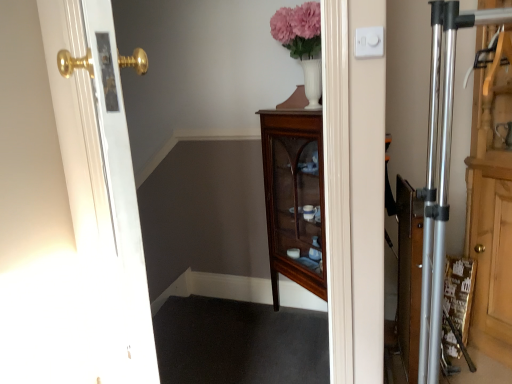
Find the location of a particular element. white glossy door at left is located at coordinates (101, 178).

The image size is (512, 384). Describe the element at coordinates (101, 178) in the screenshot. I see `white glossy door at left` at that location.

The image size is (512, 384). What do you see at coordinates (369, 42) in the screenshot?
I see `white plastic/light switch at upper right` at bounding box center [369, 42].

Where is `mahogany glass-front cabinet at center`? mahogany glass-front cabinet at center is located at coordinates (294, 198).

Who is shorter, white glossy door at left or wooden dresser at right?

white glossy door at left is shorter.

Which of these two, white glossy door at left or wooden dresser at right, is thinner?

white glossy door at left.

Can we say white glossy door at left lies outside wooden dresser at right?

That's correct, white glossy door at left is outside of wooden dresser at right.

Is point (484, 137) less distant than point (356, 34)?

No, (484, 137) is further to viewer.

Is wooden dresser at right beside white plastic/light switch at upper right?

No, wooden dresser at right is not in contact with white plastic/light switch at upper right.

Looking at this image, how far apart are wooden dresser at right and white plastic/light switch at upper right?

wooden dresser at right and white plastic/light switch at upper right are 33.51 inches apart.

Does wooden dresser at right appear on the left side of white plastic/light switch at upper right?

Incorrect, wooden dresser at right is not on the left side of white plastic/light switch at upper right.

Looking at this image, in terms of size, does white plastic/light switch at upper right appear bigger or smaller than mahogany glass-front cabinet at center?

Clearly, white plastic/light switch at upper right is smaller in size than mahogany glass-front cabinet at center.

Which is further, [378,33] or [302,272]?

The point [302,272] is farther.

In the scene shown: Between white plastic/light switch at upper right and mahogany glass-front cabinet at center, which one is positioned in front?

Positioned in front is white plastic/light switch at upper right.

In the image, there is a white glossy door at left. At what (x,y) coordinates should I click in order to perform the action: click on furniture below it (from a real-world perspective). Please return your answer as a coordinate pair (x, y). Looking at the image, I should click on (294, 198).

Is mahogany glass-front cabinet at center beside white glossy door at left?

No, mahogany glass-front cabinet at center is not touching white glossy door at left.

From a real-world perspective, is mahogany glass-front cabinet at center located higher than white glossy door at left?

Actually, mahogany glass-front cabinet at center is physically below white glossy door at left in the real world.

From the image's perspective, who appears lower, mahogany glass-front cabinet at center or white glossy door at left?

From the image's view, mahogany glass-front cabinet at center is below.

Is point (123, 213) positioned before point (366, 57)?

Yes.

Who is more distant, white glossy door at left or white plastic/light switch at upper right?

white plastic/light switch at upper right is further from the camera.

Considering the sizes of objects white glossy door at left and white plastic/light switch at upper right in the image provided, who is thinner, white glossy door at left or white plastic/light switch at upper right?

With smaller width is white plastic/light switch at upper right.

Based on the photo, are white glossy door at left and white plastic/light switch at upper right far apart?

Absolutely, white glossy door at left is distant from white plastic/light switch at upper right.

From their relative heights in the image, would you say white plastic/light switch at upper right is taller or shorter than white glossy door at left?

Considering their sizes, white plastic/light switch at upper right has less height than white glossy door at left.

Which of these two, white plastic/light switch at upper right or white glossy door at left, is smaller?

Smaller between the two is white plastic/light switch at upper right.

Which object is wider, white plastic/light switch at upper right or white glossy door at left?

white glossy door at left.

From the picture: From a real-world perspective, between white plastic/light switch at upper right and white glossy door at left, who is vertically lower?

white glossy door at left is physically lower.

Between white glossy door at left and mahogany glass-front cabinet at center, which one is positioned behind?

mahogany glass-front cabinet at center is more distant.

From the image's perspective, is white glossy door at left located above or below mahogany glass-front cabinet at center?

Based on their image positions, white glossy door at left is located above mahogany glass-front cabinet at center.

Between white glossy door at left and mahogany glass-front cabinet at center, which one has less height?

mahogany glass-front cabinet at center is shorter.

Find the location of `door that is below the wooden dresser at right (from the image's perspective)`. door that is below the wooden dresser at right (from the image's perspective) is located at coordinates (101, 178).

Where is `dresser located underneath the white plastic/light switch at upper right (from a real-world perspective)`? The height and width of the screenshot is (384, 512). dresser located underneath the white plastic/light switch at upper right (from a real-world perspective) is located at coordinates (490, 205).

From the image, which object appears to be farther from white glossy door at left, wooden dresser at right or mahogany glass-front cabinet at center?

The object further to white glossy door at left is wooden dresser at right.

Which object lies further to the anchor point mahogany glass-front cabinet at center, wooden dresser at right or white plastic/light switch at upper right?

white plastic/light switch at upper right lies further to mahogany glass-front cabinet at center than the other object.

From the image, which object appears to be nearer to mahogany glass-front cabinet at center, wooden dresser at right or white glossy door at left?

wooden dresser at right lies closer to mahogany glass-front cabinet at center than the other object.

In the scene shown: Based on their spatial positions, is mahogany glass-front cabinet at center or wooden dresser at right further from white glossy door at left?

Based on the image, wooden dresser at right appears to be further to white glossy door at left.

Considering their positions, is mahogany glass-front cabinet at center positioned closer to white plastic/light switch at upper right than white glossy door at left?

white glossy door at left.

From the picture: Based on their spatial positions, is white plastic/light switch at upper right or white glossy door at left closer to mahogany glass-front cabinet at center?

The object closer to mahogany glass-front cabinet at center is white glossy door at left.

Based on their spatial positions, is mahogany glass-front cabinet at center or white plastic/light switch at upper right further from white glossy door at left?

mahogany glass-front cabinet at center is positioned further to the anchor white glossy door at left.

Considering their positions, is white plastic/light switch at upper right positioned closer to mahogany glass-front cabinet at center than wooden dresser at right?

Based on the image, wooden dresser at right appears to be nearer to mahogany glass-front cabinet at center.

Find the location of a particular element. The width and height of the screenshot is (512, 384). light switch between mahogany glass-front cabinet at center and wooden dresser at right from left to right is located at coordinates (369, 42).

At what (x,y) coordinates should I click in order to perform the action: click on light switch between white glossy door at left and mahogany glass-front cabinet at center in the front-back direction. Please return your answer as a coordinate pair (x, y). Looking at the image, I should click on (369, 42).

At what (x,y) coordinates should I click in order to perform the action: click on light switch between white glossy door at left and wooden dresser at right in the horizontal direction. Please return your answer as a coordinate pair (x, y). This screenshot has height=384, width=512. Looking at the image, I should click on (369, 42).

The image size is (512, 384). In order to click on furniture situated between white glossy door at left and wooden dresser at right from left to right in this screenshot , I will do `click(294, 198)`.